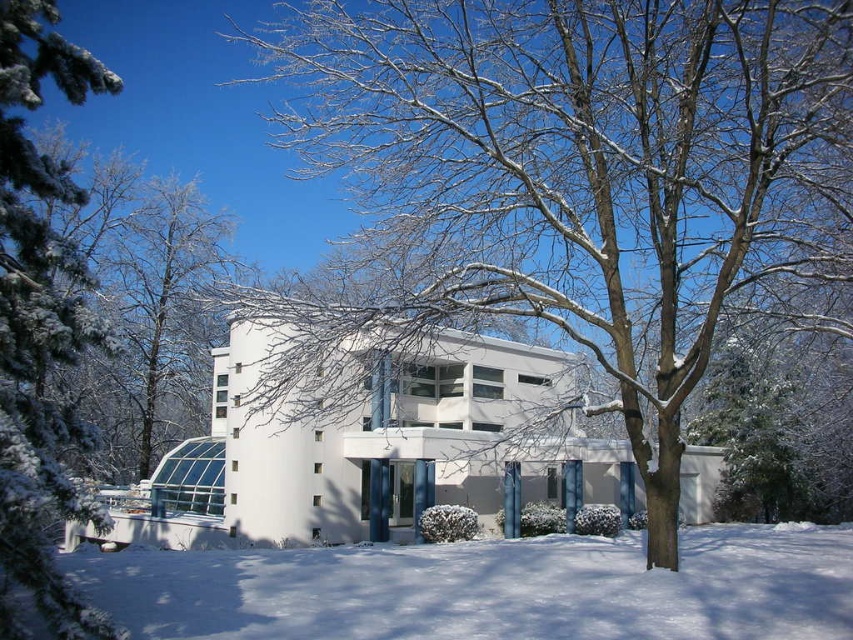
You are standing at the entrance of the modern white building and notice a point marked at coordinates (560, 182). What object is located at that point?

The point at coordinates (560, 182) marks a snow covered tree at center.

You are a delivery person standing at the white powdery snow at lower center. You need to deliver a package to the green textured pine at left. Can you walk directly to the pine without stepping on any other objects?

The distance between the white powdery snow at lower center and the green textured pine at left is 7.93 meters. Since there are no other objects mentioned in the scene between them, you can walk directly to the pine without stepping on anything else.